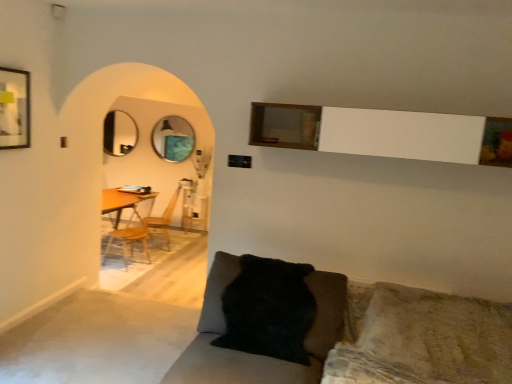
Question: Considering the positions of matte silver mirror at left, which is the second mirror from right to left, and black fuzzy pillow at lower center in the image, is matte silver mirror at left, which is the second mirror from right to left, taller or shorter than black fuzzy pillow at lower center?

Choices:
 (A) tall
 (B) short

Answer: (A)

Question: From the image's perspective, is matte silver mirror at left, which is the second mirror from right to left, positioned above or below black fuzzy pillow at lower center?

Choices:
 (A) below
 (B) above

Answer: (B)

Question: Which of these objects is positioned closest to the wooden armchair at center?

Choices:
 (A) black fuzzy pillow at lower center
 (B) matte silver mirror at left, placed as the first mirror when sorted from left to right
 (C) wooden at left
 (D) metallic circular mirror at center, the first mirror from the right
 (E) matte black picture frame at upper left

Answer: (C)

Question: Considering the real-world distances, which object is closest to the matte black picture frame at upper left?

Choices:
 (A) black fuzzy pillow at lower center
 (B) wooden armchair at center
 (C) matte silver mirror at left, placed as the first mirror when sorted from left to right
 (D) metallic circular mirror at center, arranged as the second mirror when viewed from the left
 (E) wooden at left

Answer: (A)